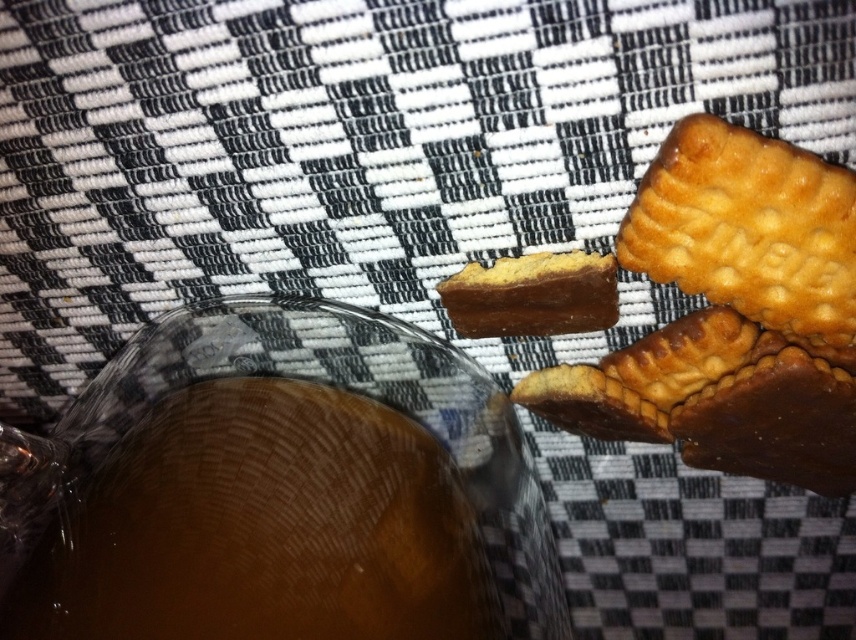
Which is below, golden textured cookie at upper right or chocolate-coated cookie at center?

chocolate-coated cookie at center is lower down.

Which is above, golden textured cookie at upper right or chocolate-coated cookie at center?

golden textured cookie at upper right is above.

Measure the distance between point (753, 314) and camera.

Point (753, 314) is 26.60 centimeters away from camera.

Image resolution: width=856 pixels, height=640 pixels. In order to click on golden textured cookie at upper right in this screenshot , I will do `click(749, 228)`.